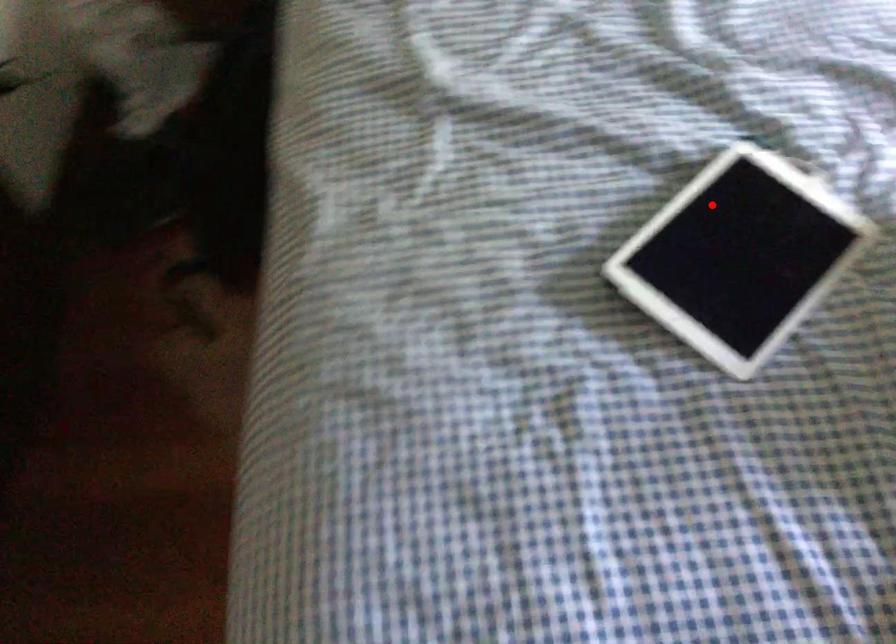
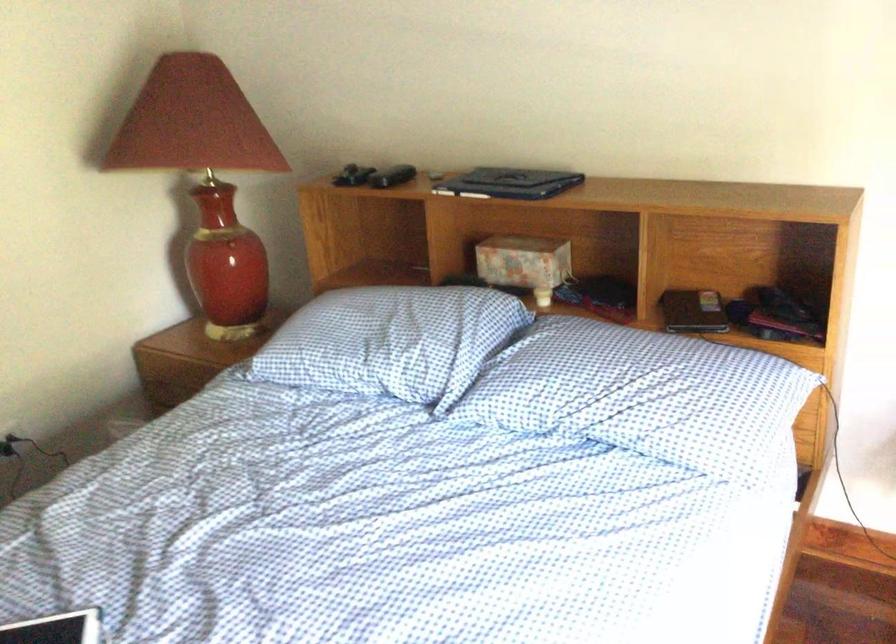
The point at the highlighted location is marked in the first image. Where is the corresponding point in the second image?

(56, 629)